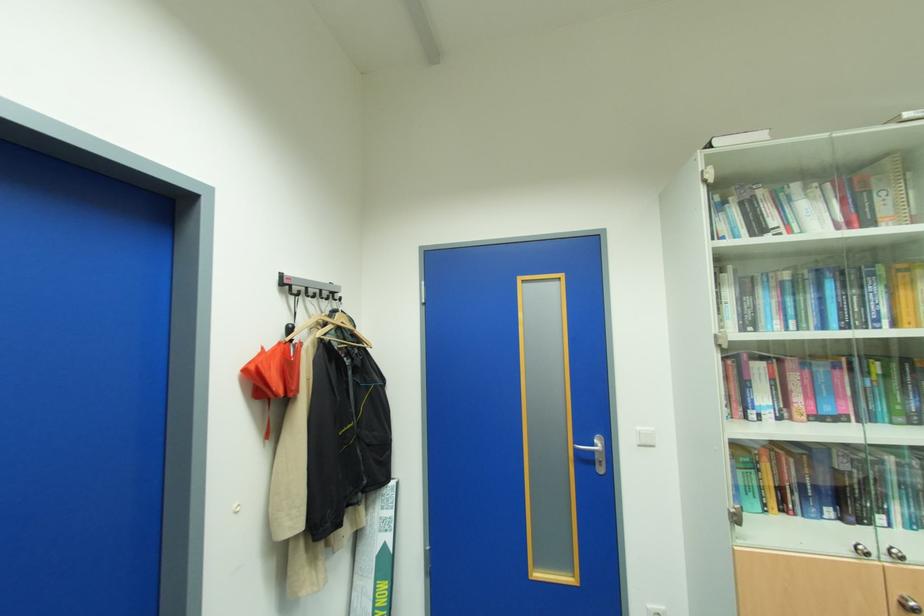
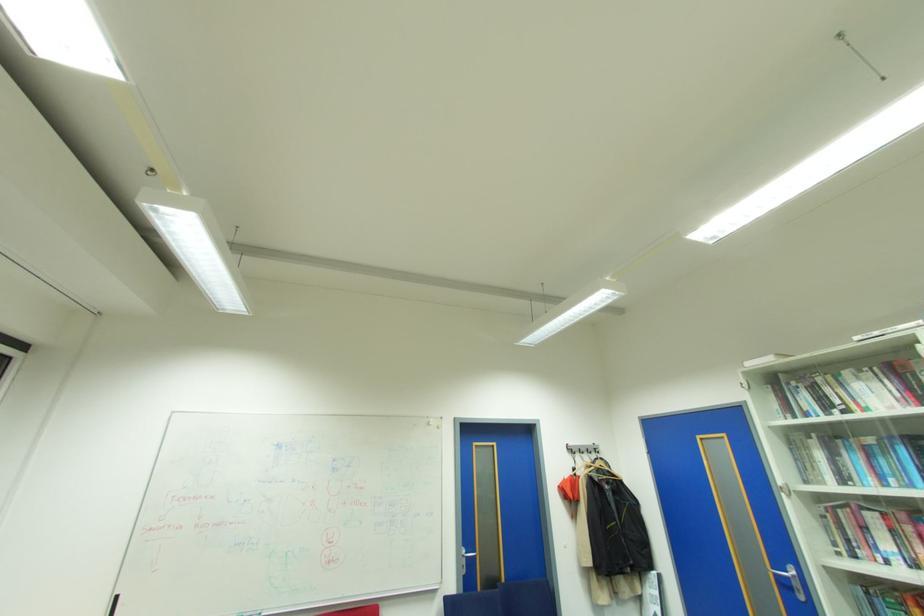
The point at (335,293) is marked in the first image. Where is the corresponding point in the second image?

(600, 448)